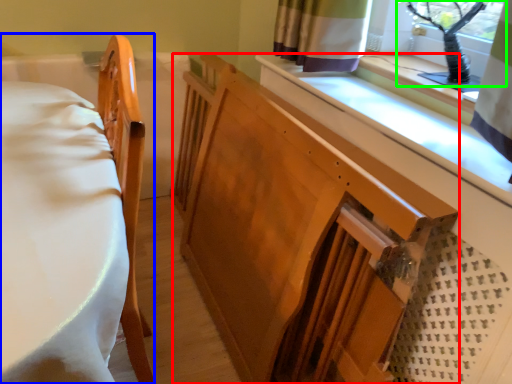
Question: Which object is the farthest from changing table (highlighted by a red box)? Choose among these: furniture (highlighted by a blue box) or window screen (highlighted by a green box).

Choices:
 (A) furniture
 (B) window screen

Answer: (B)